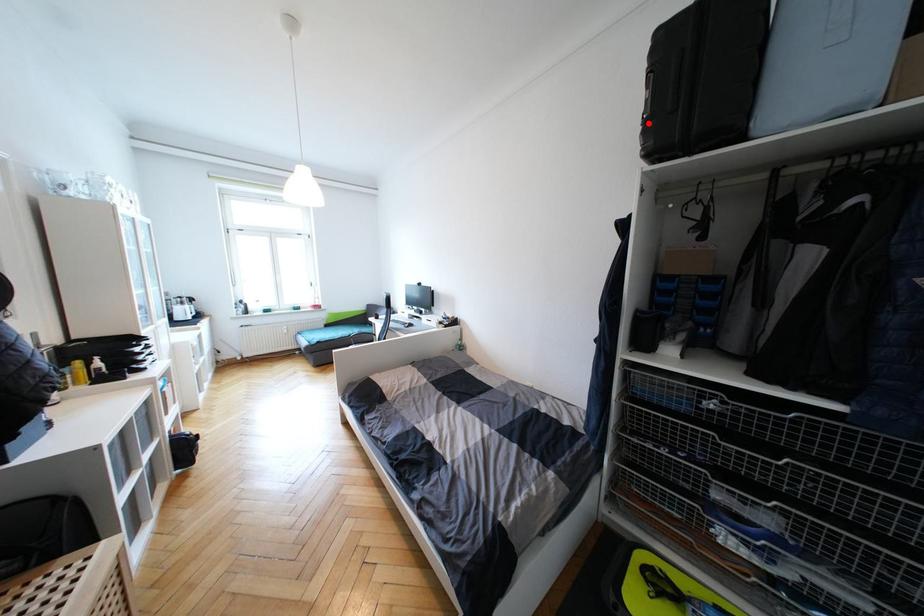
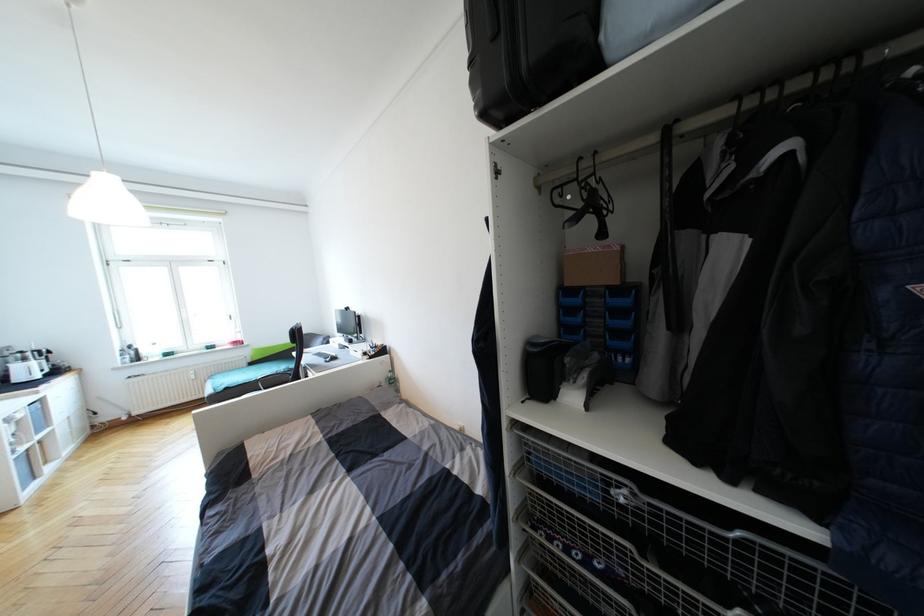
The point at the highlighted location is marked in the first image. Where is the corresponding point in the second image?

(475, 65)